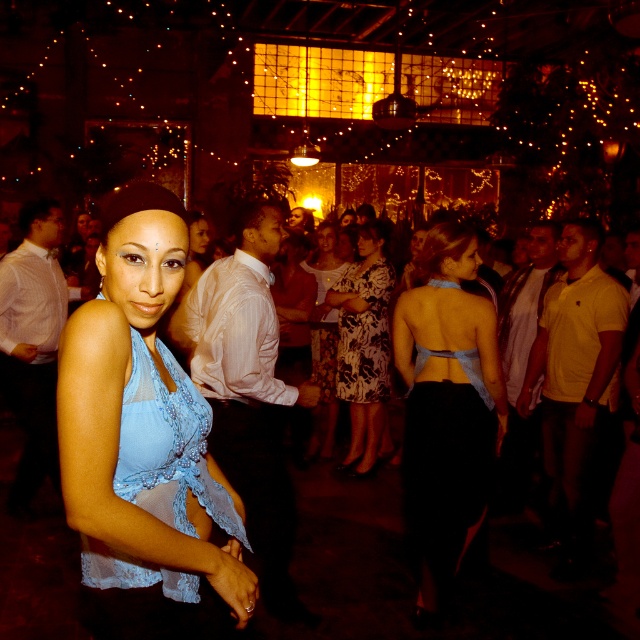
Consider the image. You are planning to wear one of these two light blue outfits for a party. Given that the light blue lace top at center is less bulky than the light blue satin dress at center, which one would be easier to move around in?

The light blue lace top at center occupies less space than the light blue satin dress at center, so it would be easier to move around in.

From the picture: You are a photographer at the party and want to capture both the light blue satin dress at center and the floral print fabric dress at center in a single frame. Since the camera has a limited field of view, which dress should you position closer to the camera to ensure both fit in the frame?

The light blue satin dress at center is wider than the floral print fabric dress at center. To fit both in the frame, position the wider light blue satin dress at center closer to the camera so its larger size can be accommodated within the limited field of view.

You are a photographer at the party and want to capture both the light blue satin dress at center and the floral print fabric dress at center in the same frame. Which dress should you focus on first to ensure both are in the shot?

The light blue satin dress at center is positioned on the right side of floral print fabric dress at center, so you should focus on the floral print fabric dress at center first to ensure both are in the shot.